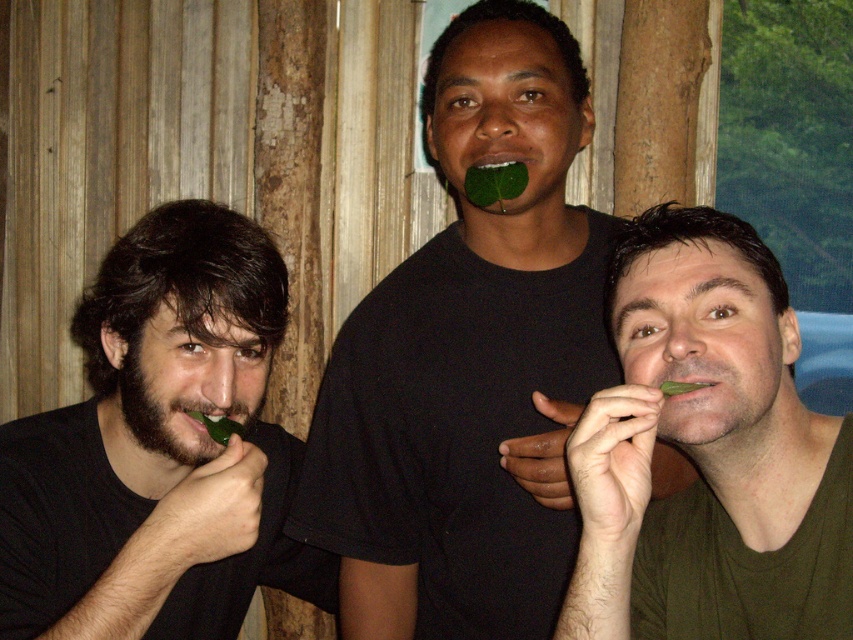
Which of these two, green matte leaf at center or dark brown hair at left, stands shorter?

With less height is dark brown hair at left.

Does green matte leaf at center appear on the right side of dark brown hair at left?

Yes, green matte leaf at center is to the right of dark brown hair at left.

Locate an element on the screen. green matte leaf at center is located at coordinates (469, 360).